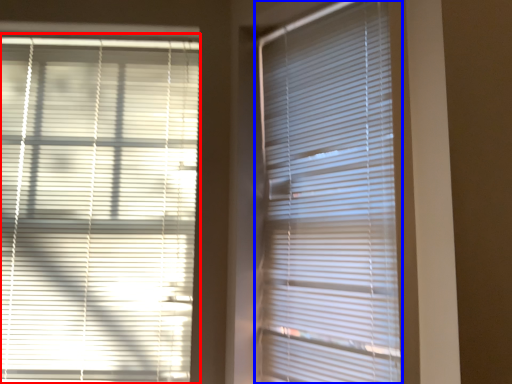
Question: Which object appears closest to the camera in this image, window blind (highlighted by a red box) or window blind (highlighted by a blue box)?

Choices:
 (A) window blind
 (B) window blind

Answer: (B)